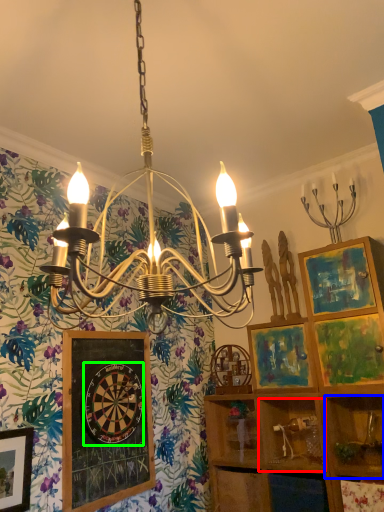
Question: Based on their relative distances, which object is farther from cabinet (highlighted by a red box)? Choose from shelf (highlighted by a blue box) and design (highlighted by a green box).

Choices:
 (A) shelf
 (B) design

Answer: (B)